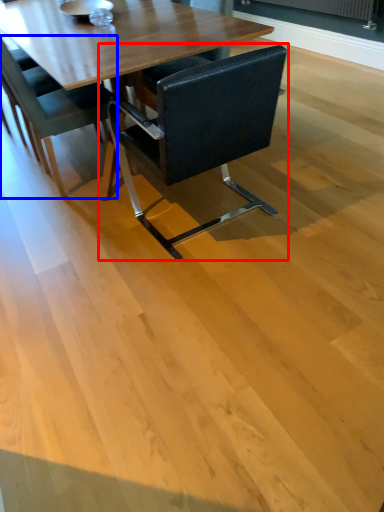
Question: Which point is further to the camera, chair (highlighted by a red box) or chair (highlighted by a blue box)?

Choices:
 (A) chair
 (B) chair

Answer: (B)